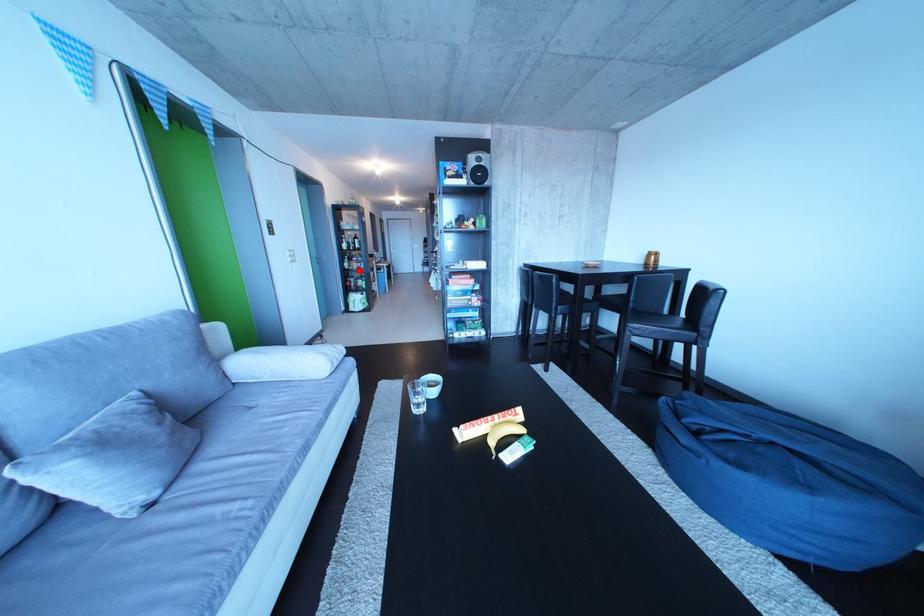
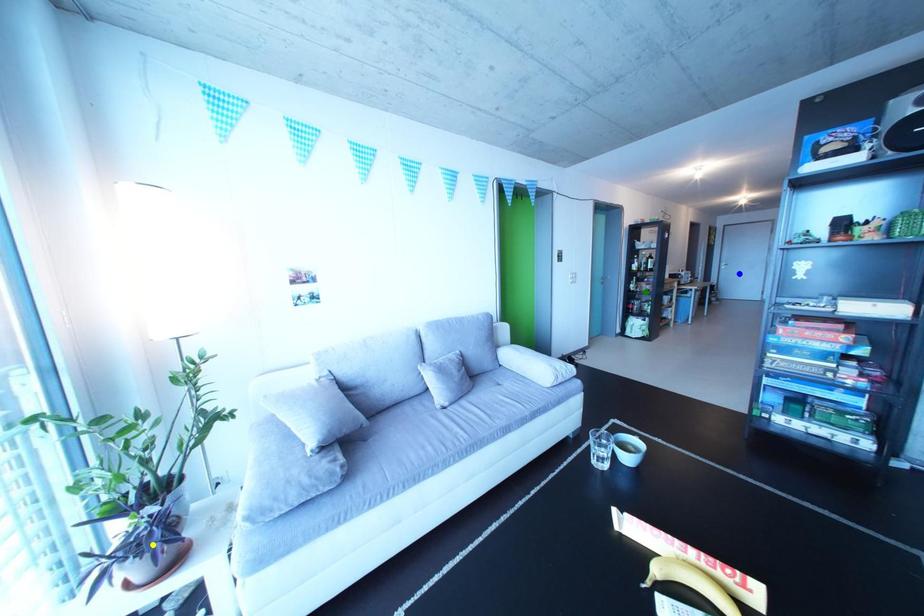
Question: I am providing you with two images of the same scene from different viewpoints. A red point is marked on the first image. You are given multiple points on the second image. Which mark in image 2 goes with the point in image 1?

Choices:
 (A) blue point
 (B) yellow point
 (C) green point

Answer: (C)